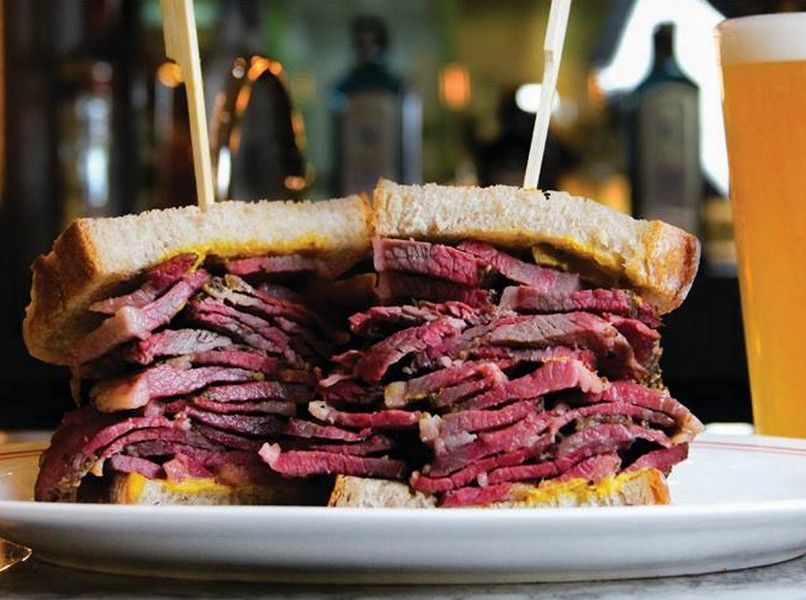
In order to click on plate in this screenshot , I will do `click(493, 544)`.